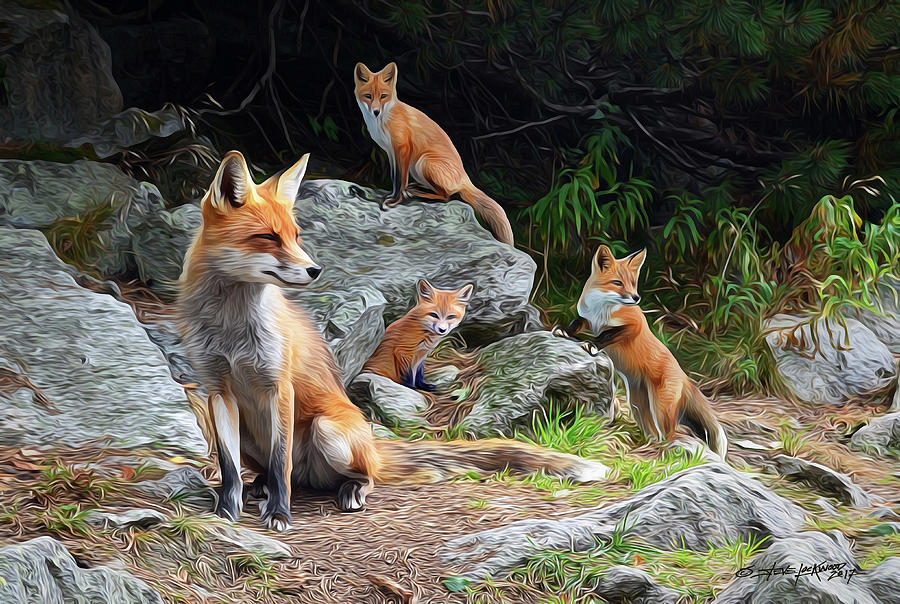
The width and height of the screenshot is (900, 604). Identify the location of wooden part. (394, 595).